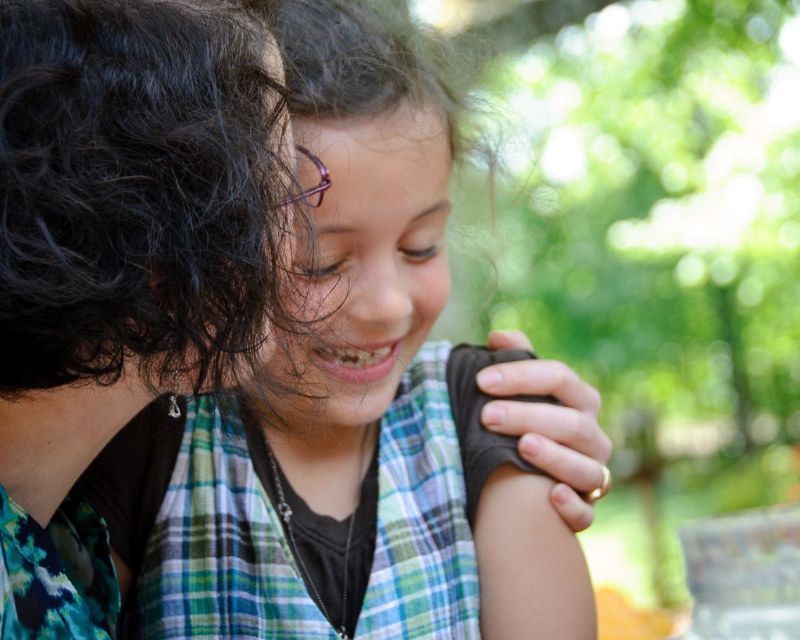
You are an observer looking at the scene. The green plaid shirt at center and the black fabric at upper left are both visible. Which object is located lower in the image?

The green plaid shirt at center is positioned under the black fabric at upper left, so it is located lower in the image.

You are a photographer adjusting your camera settings to focus on the matte green plaid shirt at center. However, you notice the black fabric at upper left might interfere with the composition. Can you determine which object is closer to your camera lens?

The black fabric at upper left is closer to the viewer than the matte green plaid shirt at center, so it will appear closer to the camera lens and may interfere with the composition.